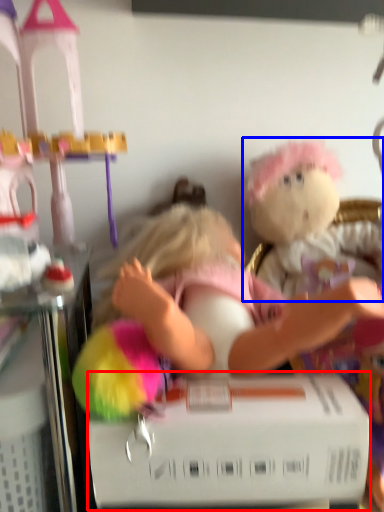
Question: Which object is further to the camera taking this photo, box (highlighted by a red box) or toy (highlighted by a blue box)?

Choices:
 (A) box
 (B) toy

Answer: (B)